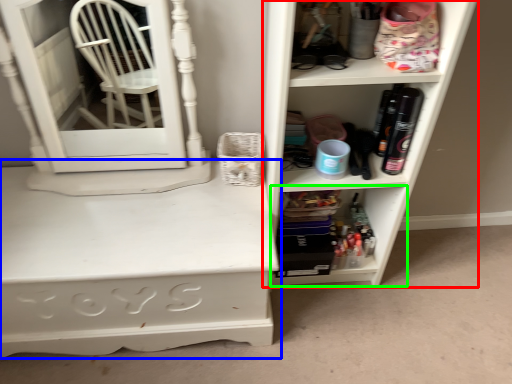
Question: Which object is the closest to the shelf (highlighted by a red box)? Choose among these: desk (highlighted by a blue box) or shelf (highlighted by a green box).

Choices:
 (A) desk
 (B) shelf

Answer: (B)